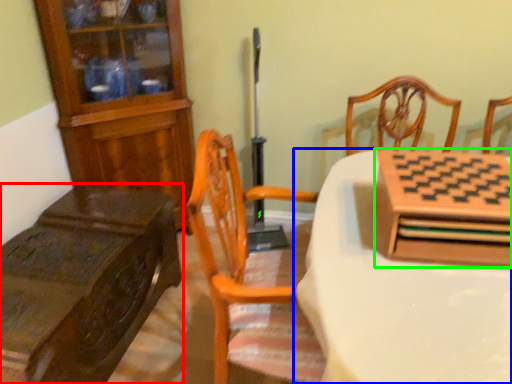
Question: Estimate the real-world distances between objects in this image. Which object is farther from table (highlighted by a red box), table (highlighted by a blue box) or cabinetry (highlighted by a green box)?

Choices:
 (A) table
 (B) cabinetry

Answer: (B)